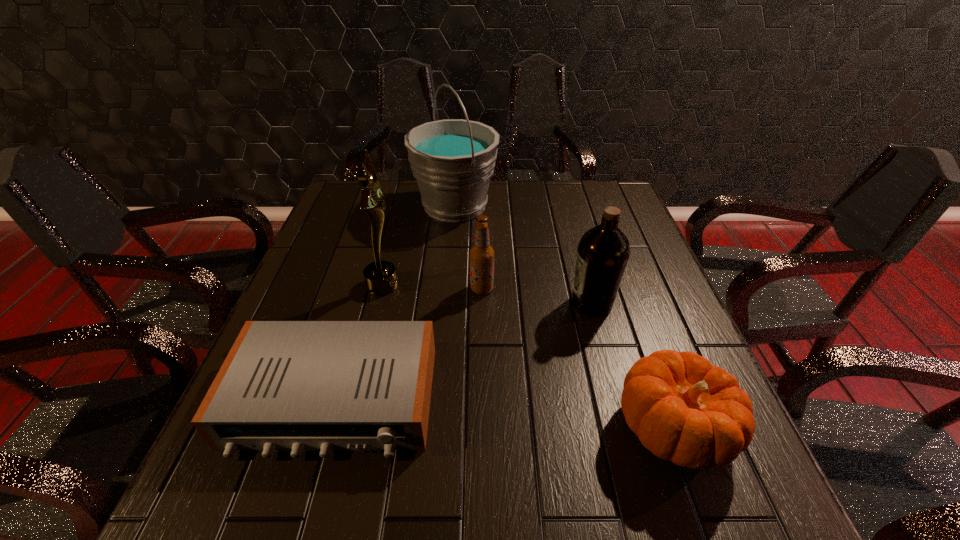
Identify the location of pumpkin at the right edge. (684, 410).

The image size is (960, 540). What are the coordinates of `object present at the near right corner` in the screenshot? It's located at (684, 410).

Where is `vacant region at the far edge of the desktop`? vacant region at the far edge of the desktop is located at coordinates (401, 207).

Where is `free space at the near edge of the desktop`? This screenshot has height=540, width=960. free space at the near edge of the desktop is located at coordinates pyautogui.click(x=527, y=513).

The width and height of the screenshot is (960, 540). In the image, there is a desktop. In order to click on blank space at the left edge in this screenshot , I will do `click(362, 268)`.

This screenshot has height=540, width=960. In the image, there is a desktop. What are the coordinates of `vacant space at the right edge` in the screenshot? It's located at (669, 321).

Find the location of a particular element. The width and height of the screenshot is (960, 540). vacant point at the far left corner is located at coordinates (361, 191).

In the image, there is a desktop. At what (x,y) coordinates should I click in order to perform the action: click on vacant space at the far right corner. Please return your answer as a coordinate pair (x, y). Looking at the image, I should click on (622, 205).

Locate an element on the screen. free point between the bucket and the award is located at coordinates (x=419, y=245).

Identify the location of unoccupied area between the pumpkin and the award. The height and width of the screenshot is (540, 960). (528, 356).